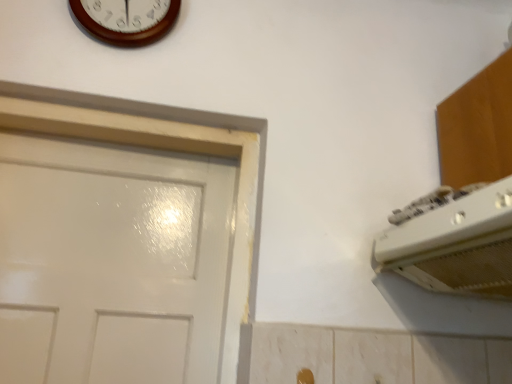
Question: In terms of width, does wooden wall clock at upper center look wider or thinner when compared to gold metallic door handle at lower center?

Choices:
 (A) thin
 (B) wide

Answer: (B)

Question: Is point (135, 11) positioned closer to the camera than point (311, 382)?

Choices:
 (A) closer
 (B) farther

Answer: (B)

Question: Which object is positioned farthest from the gold metallic door handle at lower center?

Choices:
 (A) white plastic air conditioner at upper right
 (B) wooden wall clock at upper center

Answer: (B)

Question: Which of these objects is positioned farthest from the white plastic air conditioner at upper right?

Choices:
 (A) wooden wall clock at upper center
 (B) gold metallic door handle at lower center

Answer: (A)